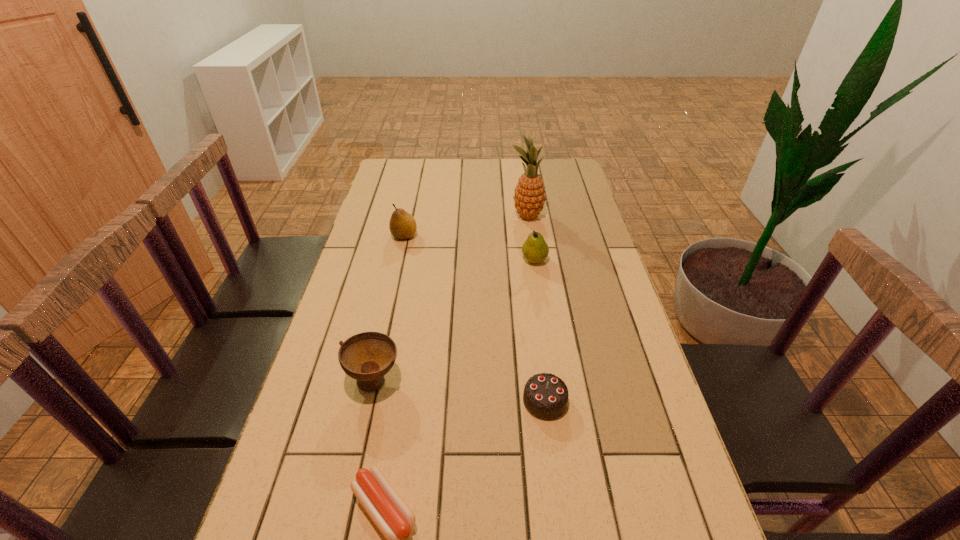
Locate an element on the screen. This screenshot has height=540, width=960. vacant area between the second shortest object and the right pear is located at coordinates (540, 330).

Where is `vacant space that's between the fifth tallest object and the nearer pear`? vacant space that's between the fifth tallest object and the nearer pear is located at coordinates (540, 330).

Identify the location of blank region between the farthest object and the farther pear. Image resolution: width=960 pixels, height=540 pixels. (466, 226).

Point out which object is positioned as the third nearest to the tallest object. Please provide its 2D coordinates. Your answer should be formatted as a tuple, i.e. [(x, y)], where the tuple contains the x and y coordinates of a point satisfying the conditions above.

[(367, 357)]

At what (x,y) coordinates should I click in order to perform the action: click on object that can be found as the fourth closest to the sausage. Please return your answer as a coordinate pair (x, y). Looking at the image, I should click on (402, 225).

The image size is (960, 540). I want to click on free space that satisfies the following two spatial constraints: 1. on the front side of the farther pear; 2. on the left side of the soup bowl, so click(x=372, y=379).

Locate an element on the screen. vacant region that satisfies the following two spatial constraints: 1. on the front side of the second shortest object; 2. on the right side of the soup bowl is located at coordinates (370, 401).